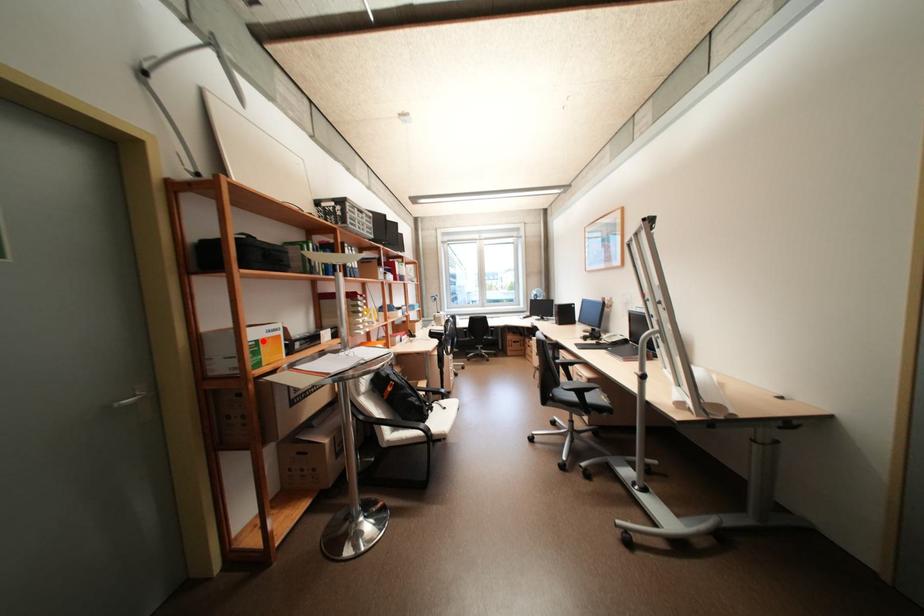
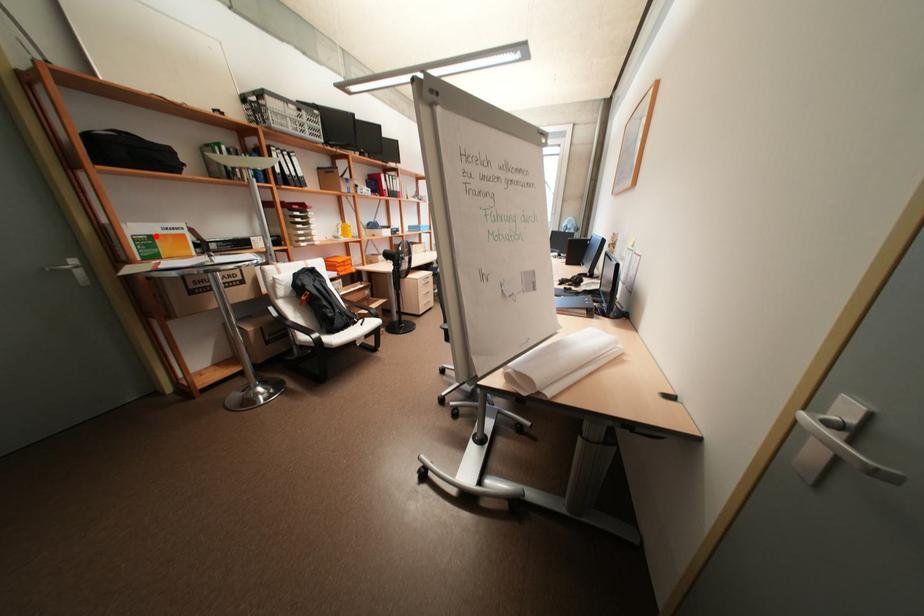
I am providing you with two images of the same scene from different viewpoints. A red point is marked on the first image and another point is marked on the second image. Do the highlighted points in image1 and image2 indicate the same real-world spot?

Yes